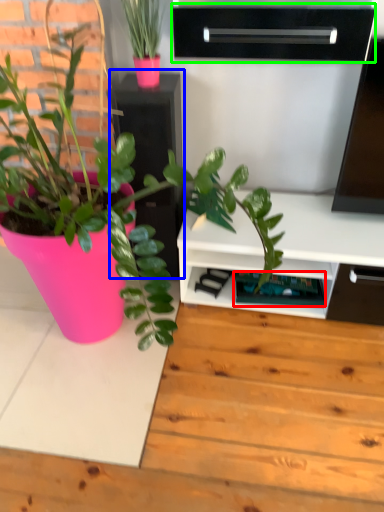
Question: Which object is positioned closest to shelf (highlighted by a red box)? Select from file cabinet (highlighted by a blue box) and shelf (highlighted by a green box).

Choices:
 (A) file cabinet
 (B) shelf

Answer: (A)